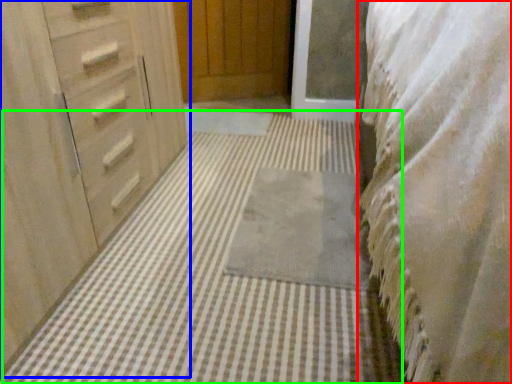
Question: Considering the real-world distances, which object is farthest from bedding (highlighted by a red box)? chest of drawers (highlighted by a blue box) or bath mat (highlighted by a green box)?

Choices:
 (A) chest of drawers
 (B) bath mat

Answer: (A)